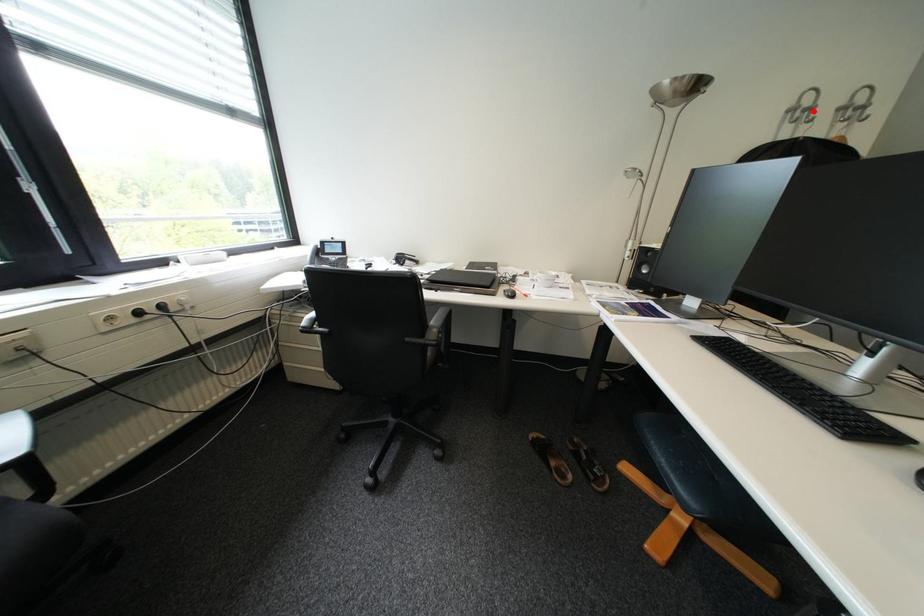
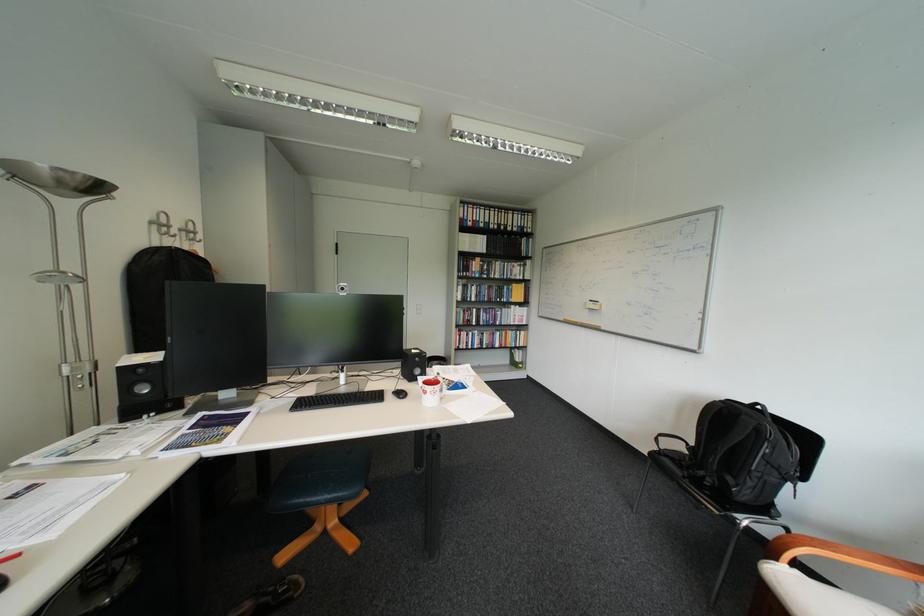
Where in the second image is the point corresponding to the highlighted location from the first image?

(173, 225)